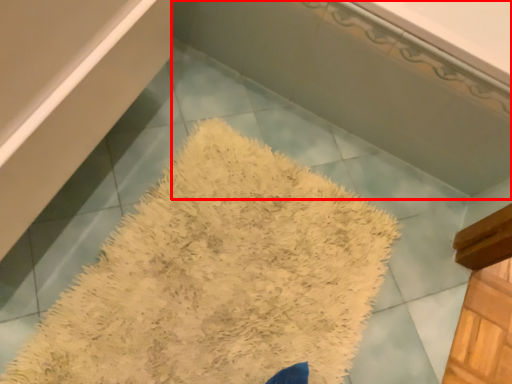
Question: Where is bath (annotated by the red box) located in relation to bath mat in the image?

Choices:
 (A) right
 (B) left

Answer: (A)